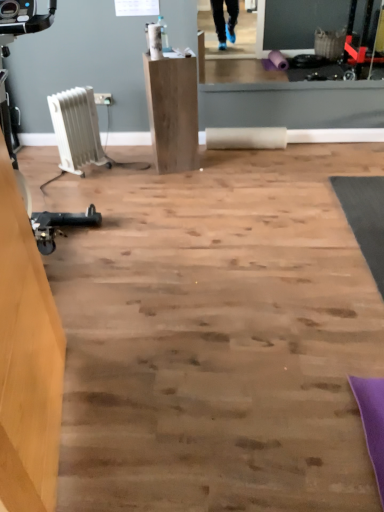
This screenshot has width=384, height=512. Describe the element at coordinates (23, 18) in the screenshot. I see `white plastic heater at left` at that location.

Identify the location of natural wood pedestal at center, arranged as the second furniture when ordered from the bottom. (172, 111).

You are a GUI agent. You are given a task and a screenshot of the screen. Output one action in this format:
    pyautogui.click(x=<x>, y=<y>)
    Task: Click on the white plastic radiator at left
    This screenshot has height=512, width=384.
    Given the screenshot: What is the action you would take?
    pyautogui.click(x=77, y=129)

Is white plastic heater at left at the back of natural wood pedestal at center, acting as the 2th furniture starting from the front?

No, natural wood pedestal at center, acting as the 2th furniture starting from the front, is not facing away from white plastic heater at left.

From a real-world perspective, is natural wood pedestal at center, the 1th furniture viewed from the back, on top of white plastic heater at left?

No.

Which object is closer to the camera taking this photo, natural wood pedestal at center, arranged as the second furniture when ordered from the bottom, or white plastic heater at left?

Positioned in front is white plastic heater at left.

Do you think natural wood pedestal at center, arranged as the second furniture when ordered from the bottom, is within white plastic heater at left, or outside of it?

natural wood pedestal at center, arranged as the second furniture when ordered from the bottom, is spatially situated outside white plastic heater at left.

From the image's perspective, who appears lower, white plastic heater at left or white plastic radiator at left?

white plastic heater at left, from the image's perspective.

Looking at this image, from their relative heights in the image, would you say white plastic heater at left is taller or shorter than white plastic radiator at left?

Considering their sizes, white plastic heater at left has more height than white plastic radiator at left.

From a real-world perspective, is white plastic heater at left positioned over white plastic radiator at left based on gravity?

Yes, from a real-world perspective, white plastic heater at left is above white plastic radiator at left.

Which object is thinner, white plastic heater at left or white plastic radiator at left?

Thinner between the two is white plastic radiator at left.

Which is closer, (67, 135) or (15, 6)?

Clearly, point (67, 135) is more distant from the camera than point (15, 6).

Find the location of a particular element. sport equipment on the left of white plastic radiator at left is located at coordinates (23, 18).

From the image's perspective, is white plastic radiator at left above white plastic heater at left?

Yes, from the image's perspective, white plastic radiator at left is on top of white plastic heater at left.

In terms of size, does white plastic radiator at left appear bigger or smaller than white plastic heater at left?

Clearly, white plastic radiator at left is smaller in size than white plastic heater at left.

Is white plastic radiator at left completely or partially inside natural wood pedestal at center, acting as the 1th furniture starting from the right?

No.

Is natural wood pedestal at center, acting as the 1th furniture starting from the right, beside white plastic radiator at left?

They are not placed beside each other.

Could you tell me if natural wood pedestal at center, acting as the 1th furniture starting from the right, is facing white plastic radiator at left?

No, natural wood pedestal at center, acting as the 1th furniture starting from the right, does not turn towards white plastic radiator at left.

How different are the orientations of natural wood pedestal at center, arranged as the second furniture when viewed from the left, and white plastic radiator at left in degrees?

The facing directions of natural wood pedestal at center, arranged as the second furniture when viewed from the left, and white plastic radiator at left are 41.5 degrees apart.

From a real-world perspective, is white plastic heater at left positioned over natural wood pedestal at center, the 1th furniture viewed from the top, based on gravity?

Correct, in the physical world, white plastic heater at left is higher than natural wood pedestal at center, the 1th furniture viewed from the top.

In the image, is white plastic heater at left on the left side or the right side of natural wood pedestal at center, acting as the 2th furniture starting from the front?

white plastic heater at left is to the left of natural wood pedestal at center, acting as the 2th furniture starting from the front.

In the scene shown: Is white plastic heater at left looking in the opposite direction of natural wood pedestal at center, acting as the 2th furniture starting from the front?

white plastic heater at left is not turned away from natural wood pedestal at center, acting as the 2th furniture starting from the front.

How distant is white plastic heater at left from natural wood pedestal at center, acting as the 1th furniture starting from the right?

white plastic heater at left is 32.92 inches from natural wood pedestal at center, acting as the 1th furniture starting from the right.

Is white plastic radiator at left looking in the opposite direction of natural wood pedestal at center, acting as the 1th furniture starting from the right?

No, white plastic radiator at left is not facing away from natural wood pedestal at center, acting as the 1th furniture starting from the right.

From a real-world perspective, does white plastic radiator at left sit lower than natural wood pedestal at center, arranged as the second furniture when viewed from the left?

Correct, in the physical world, white plastic radiator at left is lower than natural wood pedestal at center, arranged as the second furniture when viewed from the left.

Does white plastic radiator at left touch natural wood pedestal at center, the 1th furniture viewed from the back?

No, white plastic radiator at left is not with natural wood pedestal at center, the 1th furniture viewed from the back.

Looking at this image, which of these two, wooden desk at left, placed as the second furniture when sorted from back to front, or natural wood pedestal at center, arranged as the second furniture when viewed from the left, is thinner?

wooden desk at left, placed as the second furniture when sorted from back to front.

Which point is more distant from viewer, (11,256) or (179,147)?

The point (179,147) is farther from the camera.

Which of these two, wooden desk at left, arranged as the 1th furniture when viewed from the front, or natural wood pedestal at center, arranged as the second furniture when ordered from the bottom, is smaller?

Smaller between the two is natural wood pedestal at center, arranged as the second furniture when ordered from the bottom.

From the image's perspective, would you say wooden desk at left, arranged as the 1th furniture when viewed from the front, is positioned over natural wood pedestal at center, the 1th furniture viewed from the top?

No, from the image's perspective, wooden desk at left, arranged as the 1th furniture when viewed from the front, is not over natural wood pedestal at center, the 1th furniture viewed from the top.

Identify the location of furniture that is the 2nd object directly below the white plastic heater at left (from a real-world perspective). (172, 111).

I want to click on radiator on the right side of white plastic heater at left, so click(77, 129).

Based on their spatial positions, is natural wood pedestal at center, the 1th furniture viewed from the top, or white plastic radiator at left further from white plastic heater at left?

natural wood pedestal at center, the 1th furniture viewed from the top, is positioned further to the anchor white plastic heater at left.

Estimate the real-world distances between objects in this image. Which object is closer to natural wood pedestal at center, acting as the 2th furniture starting from the front, white plastic radiator at left or white plastic heater at left?

white plastic radiator at left is positioned closer to the anchor natural wood pedestal at center, acting as the 2th furniture starting from the front.

From the image, which object appears to be farther from wooden desk at left, the second furniture positioned from the top, white plastic heater at left or white plastic radiator at left?

white plastic radiator at left.

Based on their spatial positions, is wooden desk at left, acting as the 1th furniture starting from the left, or natural wood pedestal at center, arranged as the second furniture when ordered from the bottom, closer to white plastic radiator at left?

natural wood pedestal at center, arranged as the second furniture when ordered from the bottom, is closer to white plastic radiator at left.

Which object lies nearer to the anchor point white plastic heater at left, wooden desk at left, arranged as the 1th furniture when viewed from the front, or white plastic radiator at left?

white plastic radiator at left is closer to white plastic heater at left.

From the image, which object appears to be farther from wooden desk at left, arranged as the 1th furniture when viewed from the front, natural wood pedestal at center, acting as the 1th furniture starting from the right, or white plastic radiator at left?

Among the two, white plastic radiator at left is located further to wooden desk at left, arranged as the 1th furniture when viewed from the front.

Based on their spatial positions, is natural wood pedestal at center, the 1th furniture viewed from the top, or wooden desk at left, acting as the 1th furniture starting from the left, closer to white plastic heater at left?

natural wood pedestal at center, the 1th furniture viewed from the top, is positioned closer to the anchor white plastic heater at left.

Which object lies nearer to the anchor point white plastic heater at left, white plastic radiator at left or wooden desk at left, the 1th furniture positioned from the bottom?

The object closer to white plastic heater at left is white plastic radiator at left.

The width and height of the screenshot is (384, 512). Identify the location of sport equipment located between wooden desk at left, placed as the second furniture when sorted from back to front, and natural wood pedestal at center, acting as the 1th furniture starting from the right, in the depth direction. coord(23,18).

You are a GUI agent. You are given a task and a screenshot of the screen. Output one action in this format:
    pyautogui.click(x=<x>, y=<y>)
    Task: Click on the furniture located between white plastic heater at left and white plastic radiator at left in the depth direction
    This screenshot has height=512, width=384.
    Given the screenshot: What is the action you would take?
    coord(172,111)

Where is `sport equipment positioned between wooden desk at left, placed as the second furniture when sorted from back to front, and white plastic radiator at left from near to far`? This screenshot has height=512, width=384. sport equipment positioned between wooden desk at left, placed as the second furniture when sorted from back to front, and white plastic radiator at left from near to far is located at coordinates (23, 18).

At what (x,y) coordinates should I click in order to perform the action: click on furniture positioned between wooden desk at left, arranged as the 2th furniture when viewed from the right, and white plastic radiator at left from near to far. Please return your answer as a coordinate pair (x, y). The height and width of the screenshot is (512, 384). Looking at the image, I should click on (172, 111).